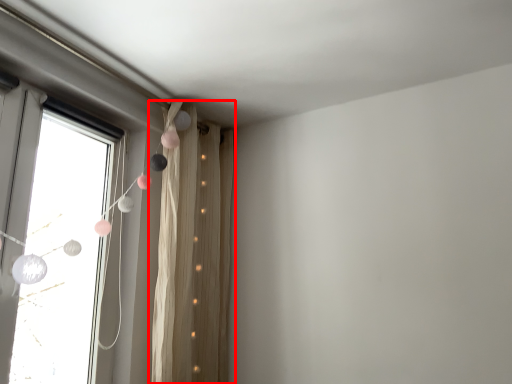
Question: From the image's perspective, where is curtain (annotated by the red box) located relative to window?

Choices:
 (A) above
 (B) below

Answer: (B)